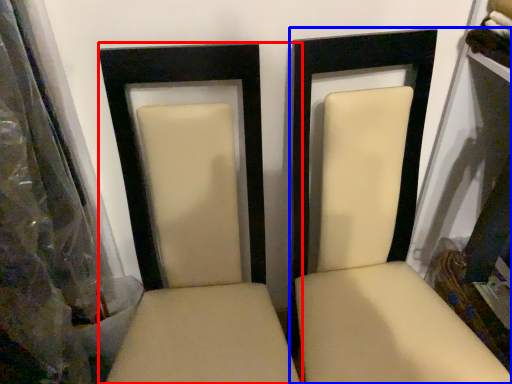
Question: Which of the following is the closest to the observer, chair (highlighted by a red box) or chair (highlighted by a blue box)?

Choices:
 (A) chair
 (B) chair

Answer: (A)